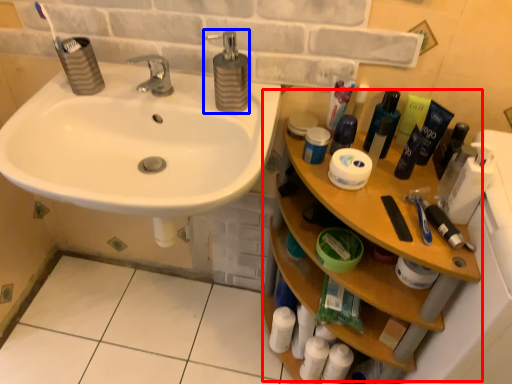
Question: Which object appears closest to the camera in this image, counter (highlighted by a red box) or soap dispenser (highlighted by a blue box)?

Choices:
 (A) counter
 (B) soap dispenser

Answer: (A)